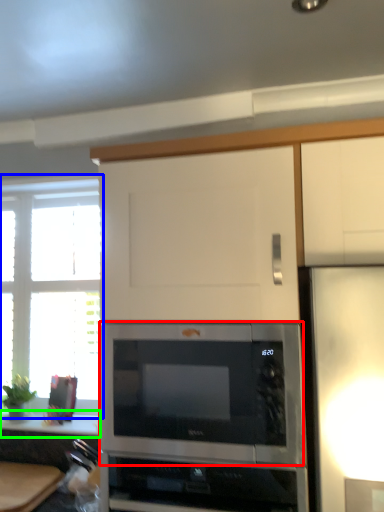
Question: Which object is positioned farthest from microwave oven (highlighted by a red box)? Select from window (highlighted by a blue box) and counter top (highlighted by a green box).

Choices:
 (A) window
 (B) counter top

Answer: (A)